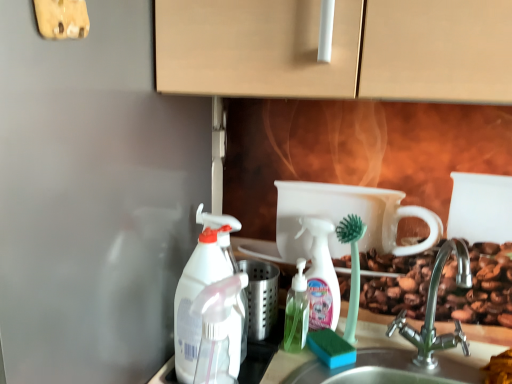
Question: Considering the relative positions of satin nickel faucet at lower right and white plastic spray bottle at left, marked as the second cleaning product in a front-to-back arrangement, in the image provided, is satin nickel faucet at lower right to the right of white plastic spray bottle at left, marked as the second cleaning product in a front-to-back arrangement, from the viewer's perspective?

Choices:
 (A) no
 (B) yes

Answer: (B)

Question: Is satin nickel faucet at lower right not near white plastic spray bottle at left, marked as the third cleaning product in a right-to-left arrangement?

Choices:
 (A) yes
 (B) no

Answer: (B)

Question: From the image's perspective, is satin nickel faucet at lower right below white plastic spray bottle at left, marked as the third cleaning product in a right-to-left arrangement?

Choices:
 (A) yes
 (B) no

Answer: (A)

Question: Does satin nickel faucet at lower right turn towards white plastic spray bottle at left, marked as the third cleaning product in a right-to-left arrangement?

Choices:
 (A) yes
 (B) no

Answer: (B)

Question: Can you confirm if satin nickel faucet at lower right is shorter than white plastic spray bottle at left, the 2th cleaning product viewed from the back?

Choices:
 (A) yes
 (B) no

Answer: (A)

Question: Is satin nickel faucet at lower right smaller than white plastic spray bottle at left, marked as the third cleaning product in a right-to-left arrangement?

Choices:
 (A) yes
 (B) no

Answer: (B)

Question: Is green translucent soap dispenser at center at the back of translucent plastic spray bottle at center, which appears as the third cleaning product when viewed from the front?

Choices:
 (A) no
 (B) yes

Answer: (B)

Question: From the image's perspective, would you say translucent plastic spray bottle at center, acting as the 1th cleaning product starting from the back, is shown under green translucent soap dispenser at center?

Choices:
 (A) no
 (B) yes

Answer: (A)

Question: Considering the relative positions of translucent plastic spray bottle at center, which appears as the third cleaning product when viewed from the front, and green translucent soap dispenser at center in the image provided, is translucent plastic spray bottle at center, which appears as the third cleaning product when viewed from the front, to the right of green translucent soap dispenser at center from the viewer's perspective?

Choices:
 (A) no
 (B) yes

Answer: (B)

Question: Does translucent plastic spray bottle at center, positioned as the third cleaning product in left-to-right order, have a lesser width compared to green translucent soap dispenser at center?

Choices:
 (A) yes
 (B) no

Answer: (A)

Question: Is the position of translucent plastic spray bottle at center, which appears as the third cleaning product when viewed from the front, more distant than that of green translucent soap dispenser at center?

Choices:
 (A) yes
 (B) no

Answer: (A)

Question: Is translucent plastic spray bottle at center, positioned as the third cleaning product in left-to-right order, far away from green translucent soap dispenser at center?

Choices:
 (A) no
 (B) yes

Answer: (A)

Question: Is satin nickel faucet at lower right to the right of green translucent soap dispenser at center from the viewer's perspective?

Choices:
 (A) no
 (B) yes

Answer: (B)